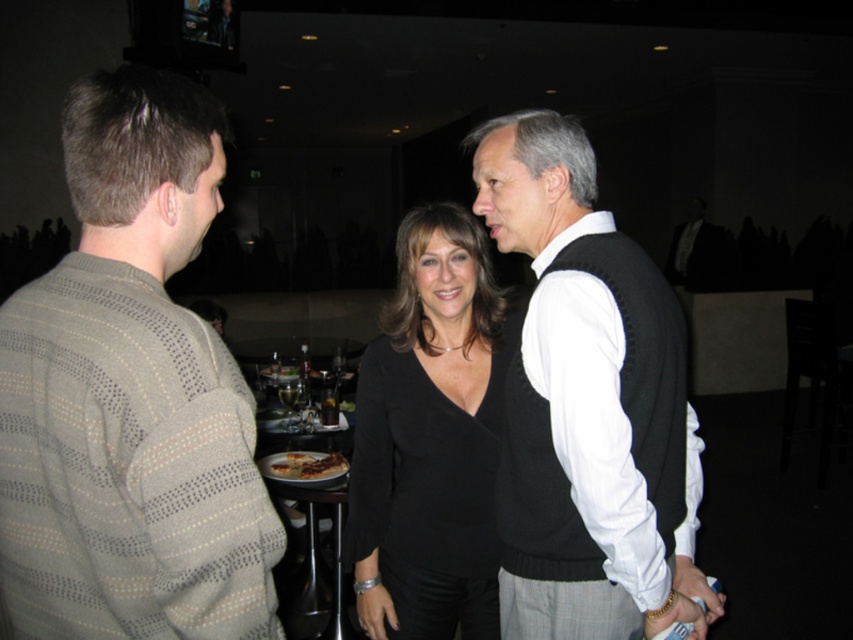
Question: Considering the real-world distances, which object is closest to the black knit vest at center?

Choices:
 (A) striped knit sweater at left
 (B) black matte top at center
 (C) wooden table at center

Answer: (B)

Question: Which object appears closest to the camera in this image?

Choices:
 (A) black knit vest at center
 (B) striped knit sweater at left
 (C) black matte top at center

Answer: (B)

Question: Is black knit vest at center thinner than black matte top at center?

Choices:
 (A) yes
 (B) no

Answer: (B)

Question: Is striped knit sweater at left positioned in front of wooden table at center?

Choices:
 (A) no
 (B) yes

Answer: (B)

Question: Which is farther from the black matte top at center?

Choices:
 (A) black knit vest at center
 (B) wooden table at center

Answer: (B)

Question: Is striped knit sweater at left further to camera compared to wooden table at center?

Choices:
 (A) yes
 (B) no

Answer: (B)